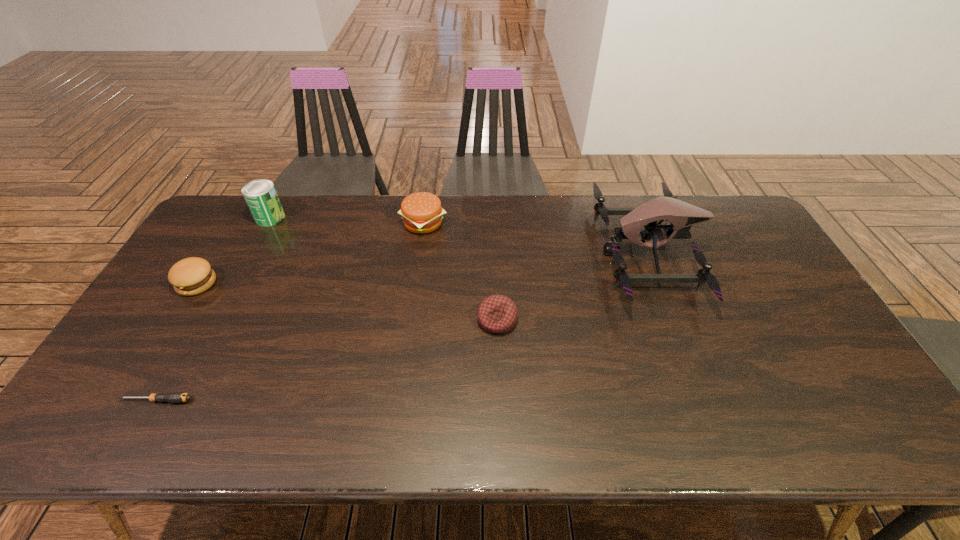
Locate an element on the screen. free area in between the can and the screwdriver is located at coordinates (213, 309).

Find the location of a particular element. unoccupied position between the beanbag and the nearest object is located at coordinates (326, 360).

Identify the location of vacant space in between the fourth shortest object and the beanbag. The image size is (960, 540). (460, 272).

The image size is (960, 540). Identify the location of free spot between the shorter hamburger and the farther hamburger. (310, 253).

I want to click on free point between the can and the beanbag, so click(384, 269).

Locate an element on the screen. This screenshot has width=960, height=540. unoccupied area between the taller hamburger and the rightmost object is located at coordinates (536, 238).

The width and height of the screenshot is (960, 540). What are the coordinates of `vacant area between the fifth object from left to right and the rightmost object` in the screenshot? It's located at (572, 287).

The width and height of the screenshot is (960, 540). In order to click on free space between the nearest object and the taller hamburger in this screenshot , I will do `click(290, 312)`.

Find the location of a particular element. The image size is (960, 540). free area in between the second tallest object and the nearer hamburger is located at coordinates (233, 251).

You are a GUI agent. You are given a task and a screenshot of the screen. Output one action in this format:
    pyautogui.click(x=<x>, y=<y>)
    Task: Click on the vacant space that's between the left hamburger and the tallest object
    The image size is (960, 540).
    Given the screenshot: What is the action you would take?
    pyautogui.click(x=422, y=268)